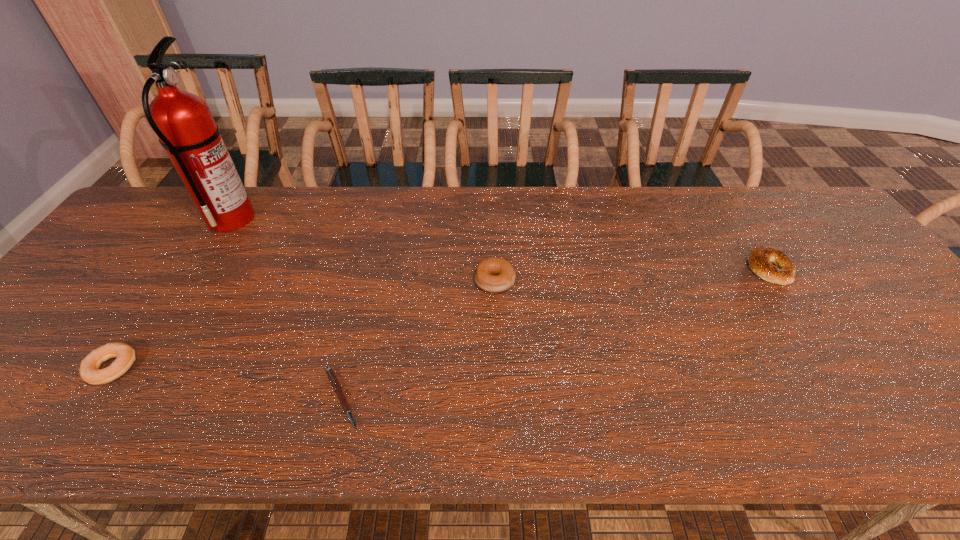
Locate an element on the screen. The image size is (960, 540). empty space that is in between the nearest bagel and the fourth object from left to right is located at coordinates (303, 325).

Locate an element on the screen. Image resolution: width=960 pixels, height=540 pixels. free space between the pen and the tallest bagel is located at coordinates (419, 340).

Locate an element on the screen. The image size is (960, 540). vacant area that lies between the fire extinguisher and the rightmost object is located at coordinates (500, 244).

At what (x,y) coordinates should I click in order to perform the action: click on empty space that is in between the fire extinguisher and the shortest object. Please return your answer as a coordinate pair (x, y). Looking at the image, I should click on (286, 308).

Image resolution: width=960 pixels, height=540 pixels. Find the location of `free space between the fourth shortest object and the rightmost object`. free space between the fourth shortest object and the rightmost object is located at coordinates (632, 275).

Identify the location of free space between the pen and the leftmost bagel. Image resolution: width=960 pixels, height=540 pixels. (227, 383).

Image resolution: width=960 pixels, height=540 pixels. I want to click on free space between the second bagel from left to right and the pen, so click(419, 340).

What are the coordinates of `vacant area that lies between the third object from right to left and the nearest bagel` in the screenshot? It's located at (227, 383).

Where is `free point between the shortest object and the farthest object`? free point between the shortest object and the farthest object is located at coordinates (286, 308).

You are a GUI agent. You are given a task and a screenshot of the screen. Output one action in this format:
    pyautogui.click(x=<x>, y=<y>)
    Task: Click on the unoccupied area between the shortest object and the second tallest object
    This screenshot has width=960, height=540.
    Given the screenshot: What is the action you would take?
    pyautogui.click(x=419, y=340)